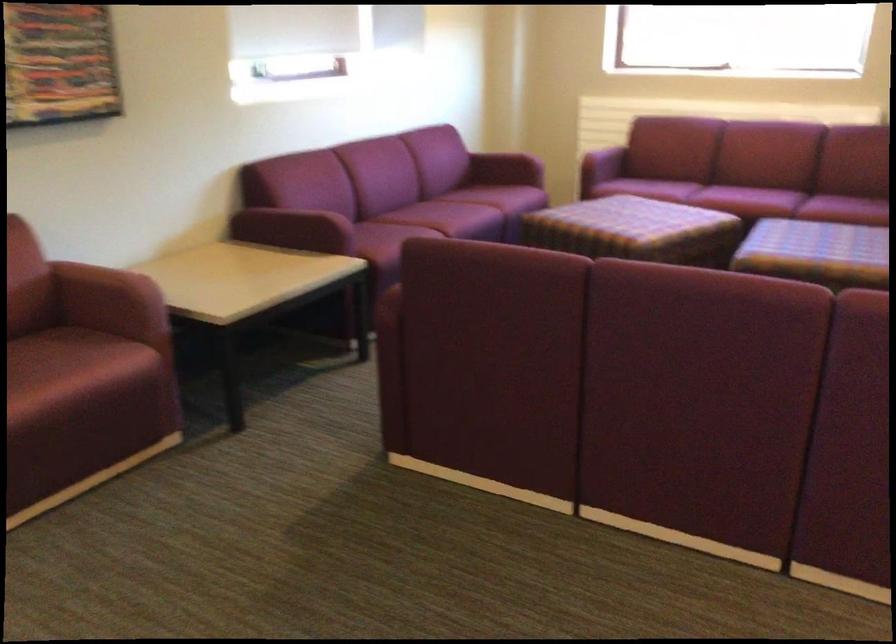
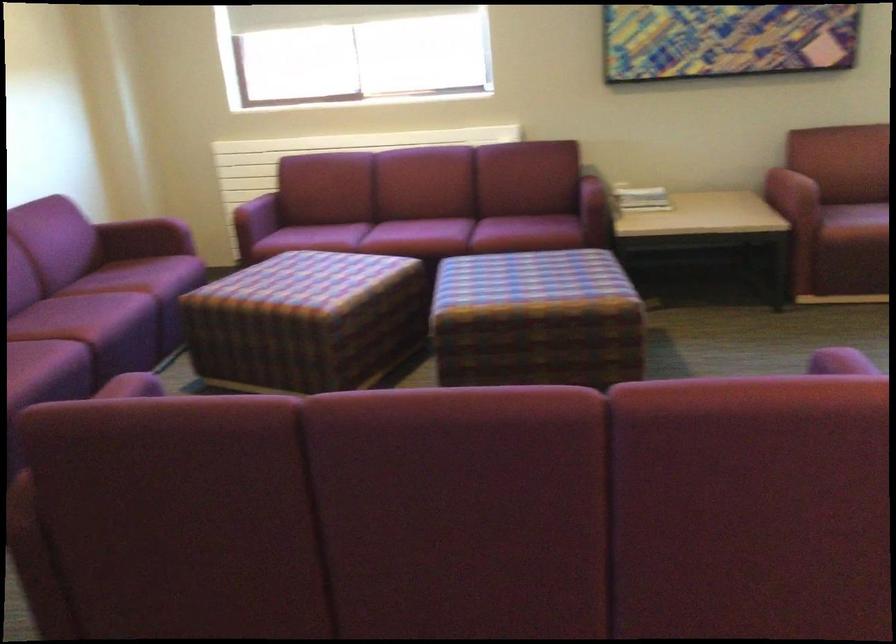
Where in the second image is the point corresponding to (x=588, y=147) from the first image?

(242, 198)